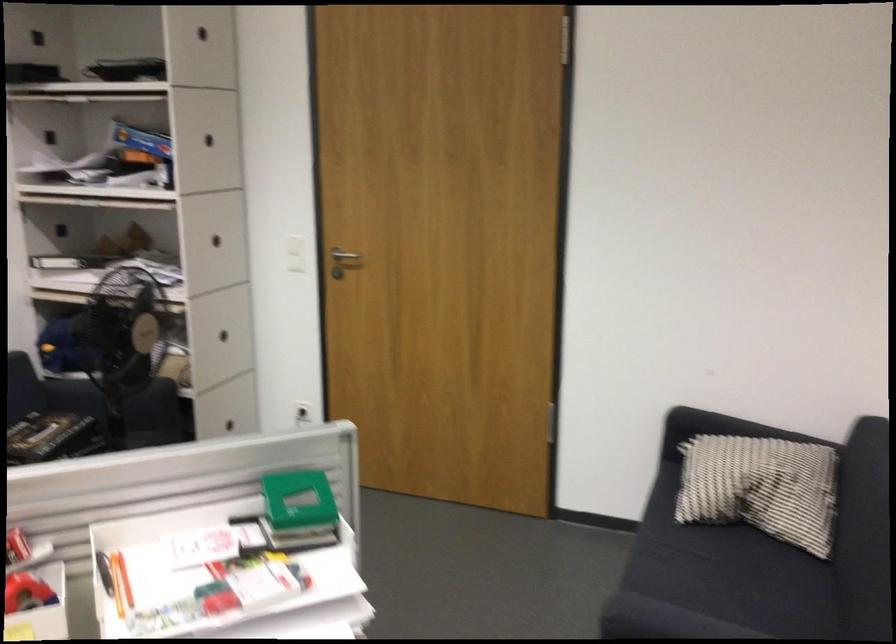
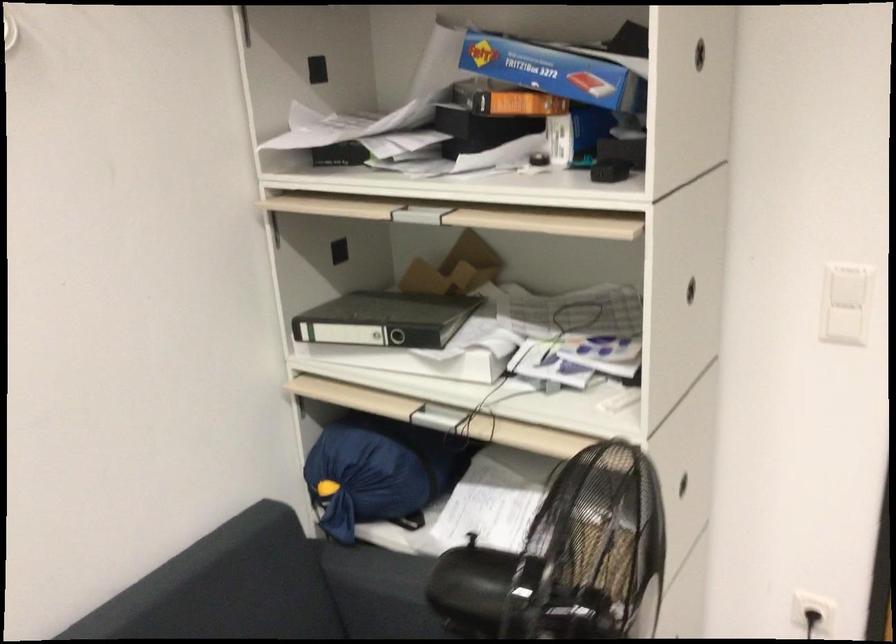
Find the pixel in the second image that matches point (299, 261) in the first image.

(843, 326)